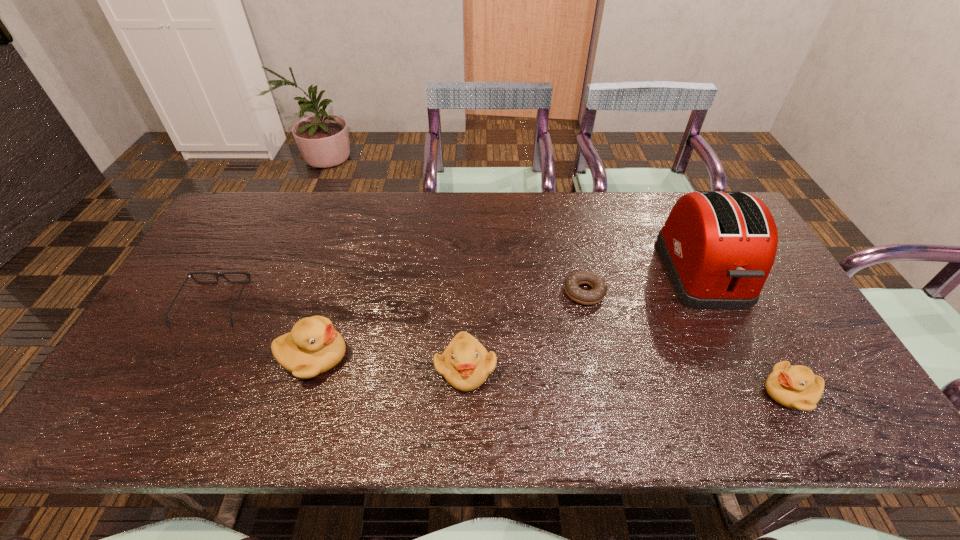
Where is `toaster positioned at the right edge`? This screenshot has height=540, width=960. toaster positioned at the right edge is located at coordinates click(718, 247).

Find the location of `object at the far right corner`. object at the far right corner is located at coordinates (718, 247).

The height and width of the screenshot is (540, 960). In order to click on object present at the near right corner in this screenshot , I will do `click(796, 387)`.

You are a GUI agent. You are given a task and a screenshot of the screen. Output one action in this format:
    pyautogui.click(x=<x>, y=<y>)
    Task: Click on the blank area at the far edge
    The width and height of the screenshot is (960, 540).
    Given the screenshot: What is the action you would take?
    pyautogui.click(x=482, y=234)

Identify the location of vacant space at the near edge of the desktop. (496, 393).

I want to click on free space at the left edge, so click(228, 286).

You are a GUI agent. You are given a task and a screenshot of the screen. Output one action in this format:
    pyautogui.click(x=<x>, y=<y>)
    Task: Click on the vacant space at the far left corner of the desktop
    
    Given the screenshot: What is the action you would take?
    pyautogui.click(x=256, y=234)

This screenshot has width=960, height=540. In order to click on free space between the second duckling from right to left and the toaster in this screenshot , I will do `click(584, 321)`.

Where is `free space between the second object from left to right and the doughnut`? The height and width of the screenshot is (540, 960). free space between the second object from left to right and the doughnut is located at coordinates (449, 325).

Locate an element on the screen. The height and width of the screenshot is (540, 960). empty location between the fourth shortest object and the tallest object is located at coordinates [x=584, y=321].